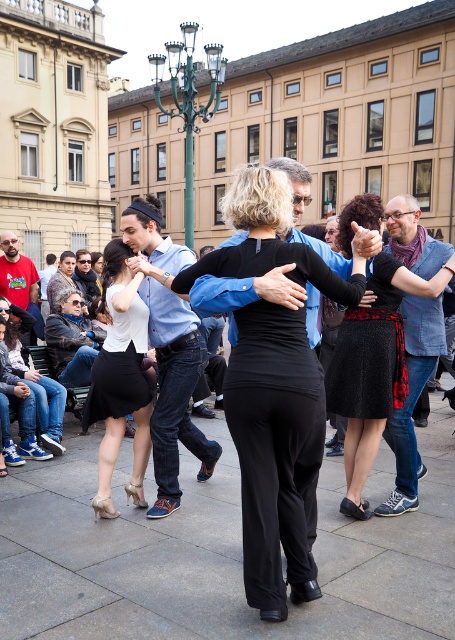
Which of these two, red cotton t-shirt at lower left or light blue denim jeans at center, stands shorter?

Standing shorter between the two is light blue denim jeans at center.

Is point (20, 298) farther from viewer compared to point (85, 275)?

No, it is not.

Measure the distance between red cotton t-shirt at lower left and camera.

They are 9.58 meters apart.

Locate an element on the screen. The image size is (455, 640). red cotton t-shirt at lower left is located at coordinates (x=16, y=273).

Is matte blue shirt at center smaller than matte white blouse at center?

Yes.

Is matte blue shirt at center to the left of matte white blouse at center from the viewer's perspective?

Incorrect, matte blue shirt at center is not on the left side of matte white blouse at center.

Who is more distant from viewer, [135,202] or [116,284]?

Positioned behind is point [135,202].

What are the coordinates of `matte blue shirt at center` in the screenshot? It's located at (167, 349).

From the picture: Can you confirm if black matte pants at center is positioned below light blue denim jeans at center?

Indeed, black matte pants at center is positioned under light blue denim jeans at center.

Can you confirm if black matte pants at center is bigger than light blue denim jeans at center?

Correct, black matte pants at center is larger in size than light blue denim jeans at center.

Describe the element at coordinates (272, 449) in the screenshot. I see `black matte pants at center` at that location.

Locate an element on the screen. black matte pants at center is located at coordinates (272, 449).